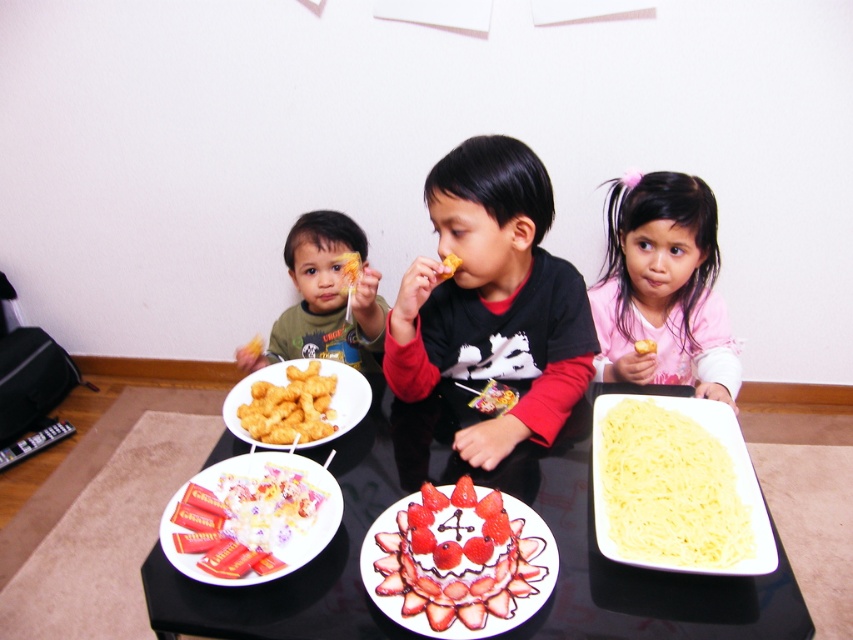
Consider the image. Is yellow pasta at lower right smaller than matte yellow snack at left?

Yes, yellow pasta at lower right is smaller than matte yellow snack at left.

Does yellow pasta at lower right appear over matte yellow snack at left?

No, yellow pasta at lower right is not above matte yellow snack at left.

You are a GUI agent. You are given a task and a screenshot of the screen. Output one action in this format:
    pyautogui.click(x=<x>, y=<y>)
    Task: Click on the yellow pasta at lower right
    
    Given the screenshot: What is the action you would take?
    pyautogui.click(x=676, y=488)

Who is positioned more to the left, black matte shirt at center or pink fabric shirt at upper right?

black matte shirt at center is more to the left.

Which is behind, point (463, 284) or point (612, 292)?

Positioned behind is point (612, 292).

Where is `black matte shirt at center`? black matte shirt at center is located at coordinates tap(492, 298).

Does smooth white plate with strawberries at center have a lesser width compared to yellow matte pasta at center?

No, smooth white plate with strawberries at center is not thinner than yellow matte pasta at center.

Which of these two, smooth white plate with strawberries at center or yellow matte pasta at center, stands shorter?

yellow matte pasta at center is shorter.

Find the location of a particular element. This screenshot has width=853, height=640. smooth white plate with strawberries at center is located at coordinates (459, 566).

Identify the location of smooth white plate with strawberries at center. Image resolution: width=853 pixels, height=640 pixels. (459, 566).